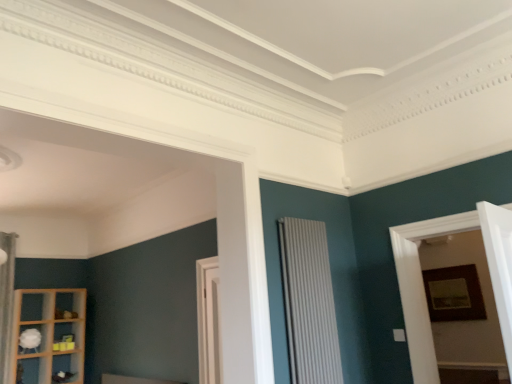
Locate an element on the screen. Image resolution: width=512 pixels, height=384 pixels. white matte shelf at lower left, which appears as the first shelf when viewed from the top is located at coordinates (30, 339).

At what (x,y) coordinates should I click in order to perform the action: click on white matte shelf at lower left, acting as the second shelf starting from the bottom. Please return your answer as a coordinate pair (x, y). Looking at the image, I should click on (30, 339).

Are white wood door at center and wooden shelf at lower left, the second shelf when ordered from top to bottom, located far from each other?

Absolutely, white wood door at center is distant from wooden shelf at lower left, the second shelf when ordered from top to bottom.

Which is nearer, (x=219, y=373) or (x=24, y=299)?

Positioned in front is point (x=219, y=373).

Looking at this image, from a real-world perspective, which object rests below the other?

wooden shelf at lower left, the first shelf when ordered from bottom to top, is physically lower.

From the image's perspective, which is above, white wood door at center or wooden shelf at lower left, the first shelf when ordered from bottom to top?

From the image's view, white wood door at center is above.

Does white fabric curtain at left come in front of white matte shelf at lower left, which appears as the first shelf when viewed from the top?

Yes, white fabric curtain at left is closer to the camera.

How many degrees apart are the facing directions of white fabric curtain at left and white matte shelf at lower left, which appears as the first shelf when viewed from the top?

The facing directions of white fabric curtain at left and white matte shelf at lower left, which appears as the first shelf when viewed from the top, are 2.38 degrees apart.

Is white fabric curtain at left facing towards white matte shelf at lower left, which appears as the first shelf when viewed from the top?

No, white fabric curtain at left does not turn towards white matte shelf at lower left, which appears as the first shelf when viewed from the top.

From a real-world perspective, is white matte shelf at lower left, acting as the second shelf starting from the bottom, positioned over wooden picture frame at right based on gravity?

No, from a real-world perspective, white matte shelf at lower left, acting as the second shelf starting from the bottom, is not above wooden picture frame at right.

Is white matte shelf at lower left, acting as the second shelf starting from the bottom, with wooden picture frame at right?

They are not placed beside each other.

You are a GUI agent. You are given a task and a screenshot of the screen. Output one action in this format:
    pyautogui.click(x=<x>, y=<y>)
    Task: Click on the picture frame above the white matte shelf at lower left, which appears as the first shelf when viewed from the top (from a real-world perspective)
    This screenshot has height=384, width=512.
    Given the screenshot: What is the action you would take?
    pyautogui.click(x=454, y=294)

Between white matte shelf at lower left, which appears as the first shelf when viewed from the top, and wooden picture frame at right, which one has larger width?

With larger width is white matte shelf at lower left, which appears as the first shelf when viewed from the top.

Is white fabric curtain at left taller or shorter than white wood door at center?

white fabric curtain at left is taller than white wood door at center.

Which object is wider, white fabric curtain at left or white wood door at center?

Wider between the two is white fabric curtain at left.

Considering the relative positions of white fabric curtain at left and white wood door at center in the image provided, is white fabric curtain at left behind white wood door at center?

Yes, white fabric curtain at left is further from the camera.

From the image's perspective, is white fabric curtain at left above or below white wood door at center?

From the image's perspective, white fabric curtain at left appears below white wood door at center.

Looking at this image, how different are the orientations of wooden framed picture at right and white matte shelf at lower left, acting as the second shelf starting from the bottom, in degrees?

The angular difference between wooden framed picture at right and white matte shelf at lower left, acting as the second shelf starting from the bottom, is 87.3 degrees.

Consider the image. From the image's perspective, between wooden framed picture at right and white matte shelf at lower left, acting as the second shelf starting from the bottom, which one is located above?

From the image's view, wooden framed picture at right is above.

Starting from the wooden framed picture at right, which shelf is the 2nd one to the left? Please provide its 2D coordinates.

[(30, 339)]

Would you say wooden framed picture at right contains white matte shelf at lower left, acting as the second shelf starting from the bottom?

No, white matte shelf at lower left, acting as the second shelf starting from the bottom, is not surrounded by wooden framed picture at right.

From the image's perspective, relative to white textured radiator at center, is wooden shelf at lower left, the first shelf when ordered from bottom to top, above or below?

Based on their image positions, wooden shelf at lower left, the first shelf when ordered from bottom to top, is located beneath white textured radiator at center.

Is wooden shelf at lower left, the first shelf when ordered from bottom to top, taller or shorter than white textured radiator at center?

Considering their sizes, wooden shelf at lower left, the first shelf when ordered from bottom to top, has more height than white textured radiator at center.

Is wooden shelf at lower left, the second shelf when ordered from top to bottom, oriented towards white textured radiator at center?

Yes, wooden shelf at lower left, the second shelf when ordered from top to bottom, is turned towards white textured radiator at center.

What's the angular difference between wooden shelf at lower left, the first shelf when ordered from bottom to top, and white textured radiator at center's facing directions?

There is a 2.43-degree angle between the facing directions of wooden shelf at lower left, the first shelf when ordered from bottom to top, and white textured radiator at center.

Is white wood door at center facing towards white textured radiator at center?

No, white wood door at center is not facing towards white textured radiator at center.

From the image's perspective, is white wood door at center above or below white textured radiator at center?

Based on their image positions, white wood door at center is located beneath white textured radiator at center.

Are white wood door at center and white textured radiator at center located far from each other?

Yes, white wood door at center is far from white textured radiator at center.

Is white wood door at center bigger than white textured radiator at center?

Yes, white wood door at center is bigger than white textured radiator at center.

You are a GUI agent. You are given a task and a screenshot of the screen. Output one action in this format:
    pyautogui.click(x=<x>, y=<y>)
    Task: Click on the 1st shelf counting from the left of the white wood door at center
    This screenshot has height=384, width=512.
    Given the screenshot: What is the action you would take?
    pyautogui.click(x=50, y=334)

The width and height of the screenshot is (512, 384). In order to click on curtain that appears above the white matte shelf at lower left, acting as the second shelf starting from the bottom (from a real-world perspective) in this screenshot , I will do `click(6, 301)`.

Looking at the image, which one is located closer to white textured radiator at center, white wood door at center or white fabric curtain at left?

The object closer to white textured radiator at center is white wood door at center.

Estimate the real-world distances between objects in this image. Which object is further from white wood door at center, wooden shelf at lower left, the second shelf when ordered from top to bottom, or wooden picture frame at right?

Among the two, wooden picture frame at right is located further to white wood door at center.

Considering their positions, is wooden picture frame at right positioned further to wooden shelf at lower left, the first shelf when ordered from bottom to top, than white wood door at center?

Based on the image, wooden picture frame at right appears to be further to wooden shelf at lower left, the first shelf when ordered from bottom to top.

Which object lies nearer to the anchor point wooden framed picture at right, white matte shelf at lower left, acting as the second shelf starting from the bottom, or white fabric curtain at left?

white matte shelf at lower left, acting as the second shelf starting from the bottom.

When comparing their distances from white fabric curtain at left, does white matte shelf at lower left, acting as the second shelf starting from the bottom, or wooden framed picture at right seem closer?

white matte shelf at lower left, acting as the second shelf starting from the bottom, is closer to white fabric curtain at left.

Estimate the real-world distances between objects in this image. Which object is further from white matte shelf at lower left, acting as the second shelf starting from the bottom, white textured radiator at center or white wood door at center?

Based on the image, white textured radiator at center appears to be further to white matte shelf at lower left, acting as the second shelf starting from the bottom.

From the image, which object appears to be nearer to white textured radiator at center, wooden framed picture at right or white wood door at center?

wooden framed picture at right is positioned closer to the anchor white textured radiator at center.

Estimate the real-world distances between objects in this image. Which object is further from wooden shelf at lower left, the second shelf when ordered from top to bottom, wooden framed picture at right or white matte shelf at lower left, acting as the second shelf starting from the bottom?

Based on the image, wooden framed picture at right appears to be further to wooden shelf at lower left, the second shelf when ordered from top to bottom.

I want to click on door between white matte shelf at lower left, acting as the second shelf starting from the bottom, and wooden framed picture at right from left to right, so click(x=212, y=325).

The height and width of the screenshot is (384, 512). In order to click on radiator between wooden framed picture at right and wooden picture frame at right in the front-back direction in this screenshot , I will do `click(309, 303)`.

At what (x,y) coordinates should I click in order to perform the action: click on radiator between white fabric curtain at left and wooden framed picture at right in the horizontal direction. Please return your answer as a coordinate pair (x, y). The image size is (512, 384). Looking at the image, I should click on [x=309, y=303].

You are a GUI agent. You are given a task and a screenshot of the screen. Output one action in this format:
    pyautogui.click(x=<x>, y=<y>)
    Task: Click on the door between white fabric curtain at left and wooden picture frame at right
    Image resolution: width=512 pixels, height=384 pixels.
    Given the screenshot: What is the action you would take?
    pyautogui.click(x=212, y=325)